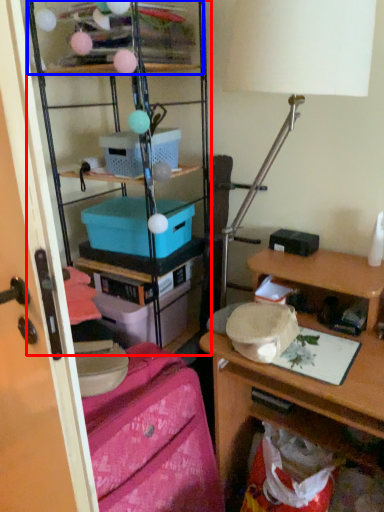
Question: Which object is closer to the camera taking this photo, shelf (highlighted by a red box) or shelf (highlighted by a blue box)?

Choices:
 (A) shelf
 (B) shelf

Answer: (A)